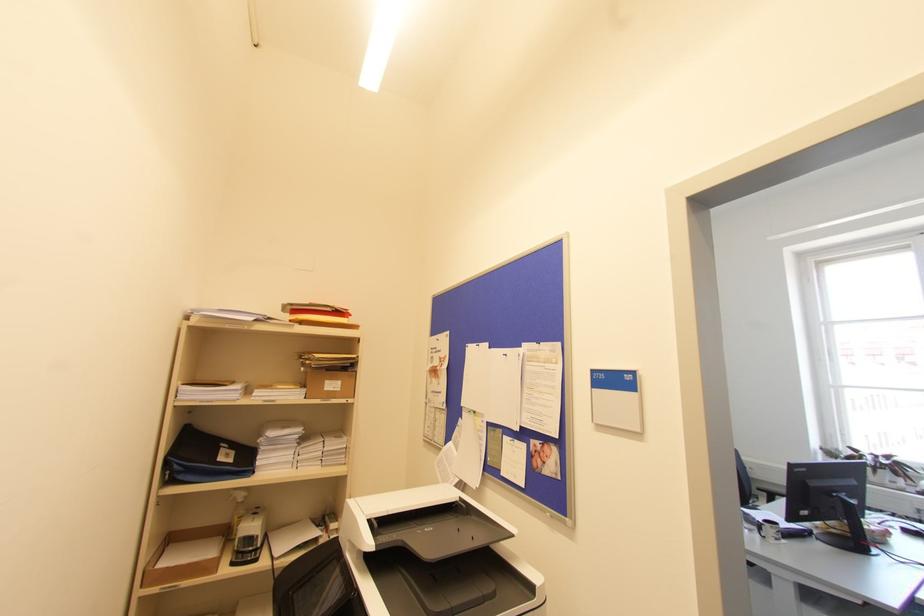
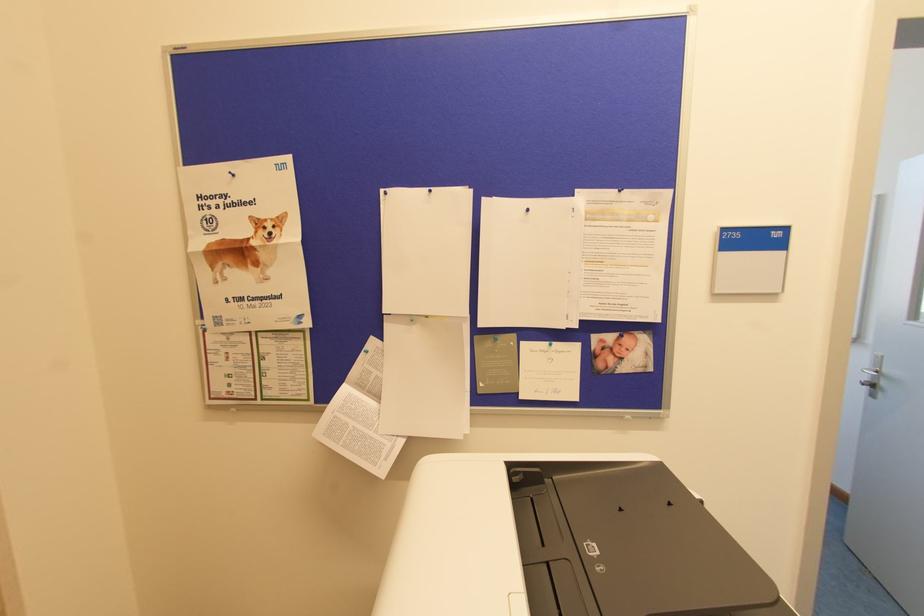
The point at [478,345] is marked in the first image. Where is the corresponding point in the second image?

(430, 191)